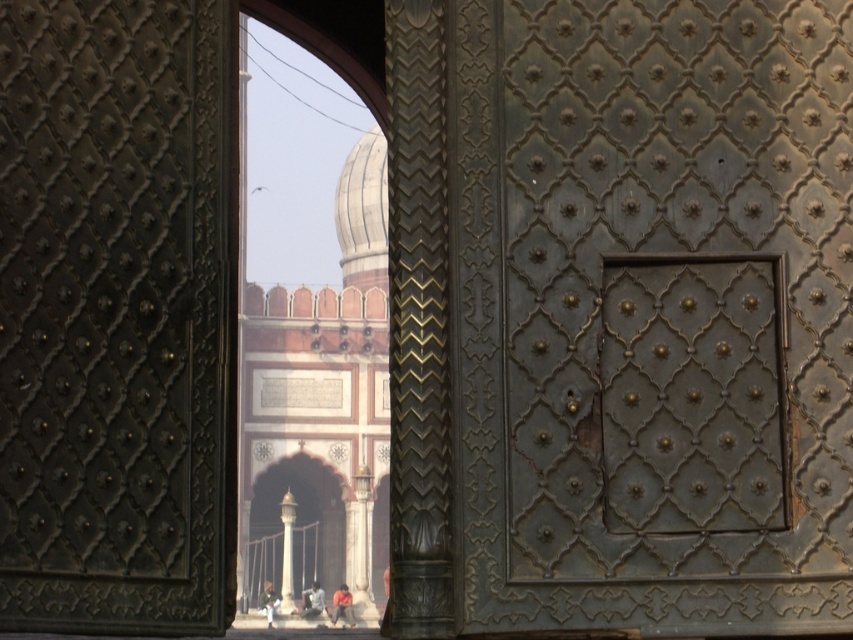
Question: Which object is the closest to the dark brown leather pants at center?

Choices:
 (A) dark gray fabric man at center
 (B) light brown leather jacket at center
 (C) white marble dome at center
 (D) dark gray metal door at center

Answer: (A)

Question: Does dark gray metal door at center come in front of white marble dome at center?

Choices:
 (A) no
 (B) yes

Answer: (B)

Question: In this image, where is dark gray fabric man at center located relative to light brown leather jacket at center?

Choices:
 (A) above
 (B) below

Answer: (B)

Question: Among these points, which one is nearest to the camera?

Choices:
 (A) (688, 433)
 (B) (260, 593)

Answer: (A)

Question: Among these points, which one is nearest to the camera?

Choices:
 (A) (260, 602)
 (B) (363, 451)
 (C) (579, 584)
 (D) (350, 609)

Answer: (C)

Question: Is the position of dark gray metal door at center more distant than that of white marble dome at center?

Choices:
 (A) no
 (B) yes

Answer: (A)